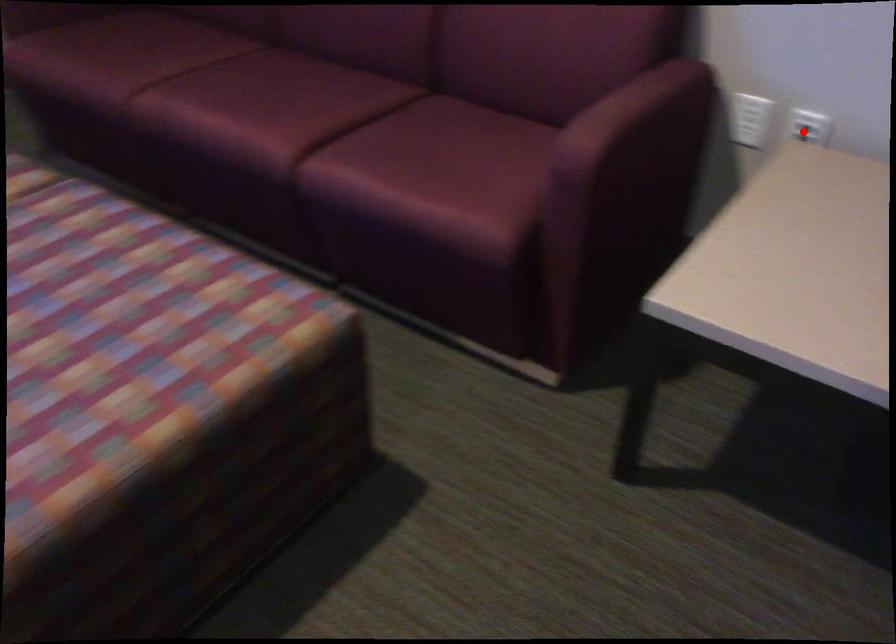
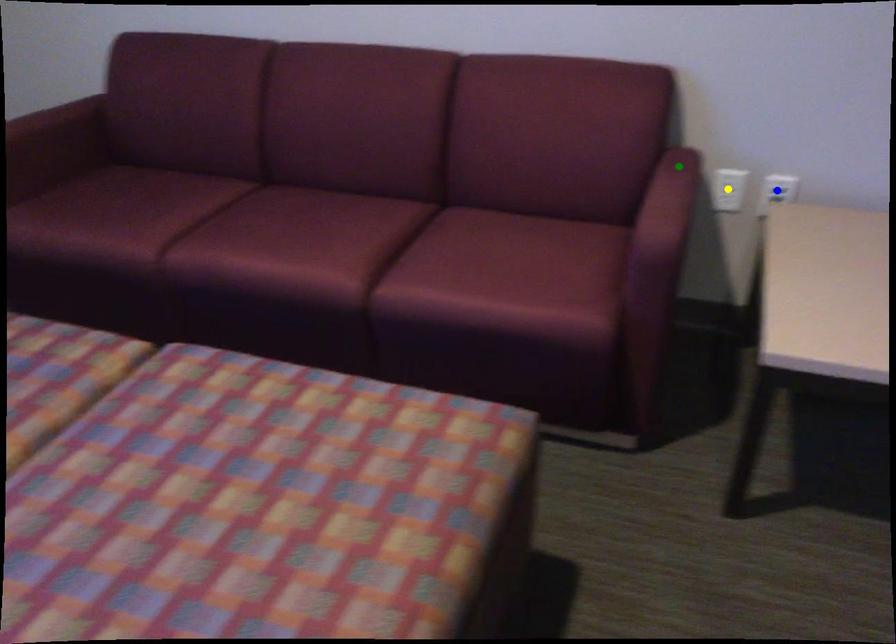
Question: I am providing you with two images of the same scene from different viewpoints. A red point is marked on the first image. You are given multiple points on the second image. Which spot in image 2 lines up with the point in image 1?

Choices:
 (A) blue point
 (B) green point
 (C) yellow point

Answer: (A)